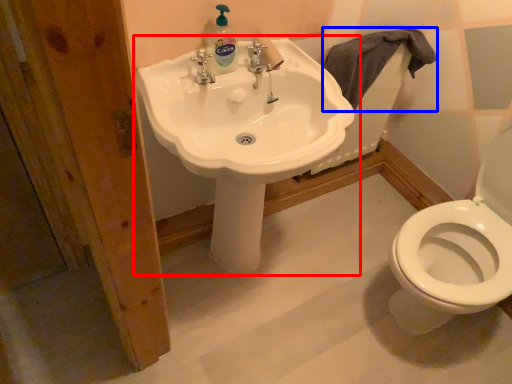
Question: Which object is further to the camera taking this photo, sink (highlighted by a red box) or bath towel (highlighted by a blue box)?

Choices:
 (A) sink
 (B) bath towel

Answer: (B)